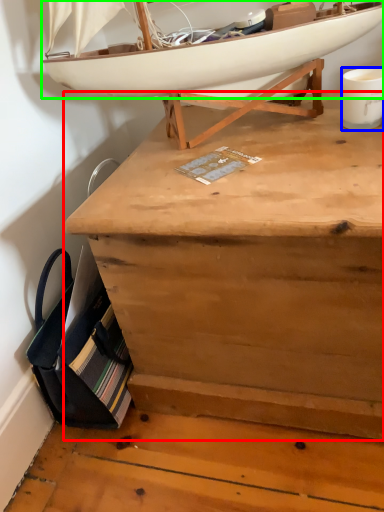
Question: Estimate the real-world distances between objects in this image. Which object is closer to desk (highlighted by a red box), coffee cup (highlighted by a blue box) or boat (highlighted by a green box)?

Choices:
 (A) coffee cup
 (B) boat

Answer: (B)